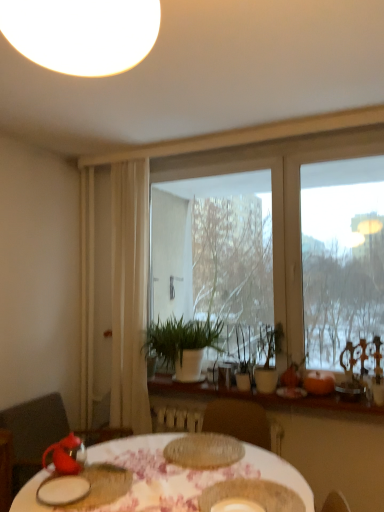
Where is `blank space situated above orange matte pumpkin at right, arranged as the 2th tableware when viewed from the right (from a real-world perspective)`? blank space situated above orange matte pumpkin at right, arranged as the 2th tableware when viewed from the right (from a real-world perspective) is located at coordinates (323, 368).